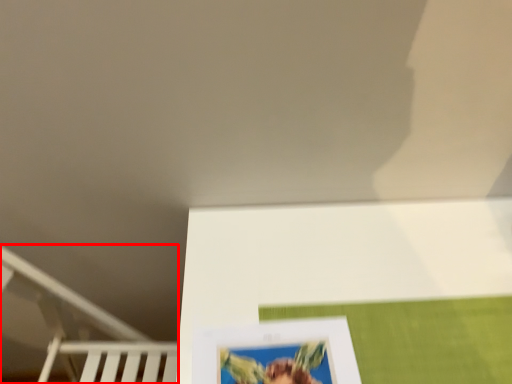
Question: From the image's perspective, where is bunk bed (annotated by the red box) located relative to picture frame?

Choices:
 (A) below
 (B) above

Answer: (A)